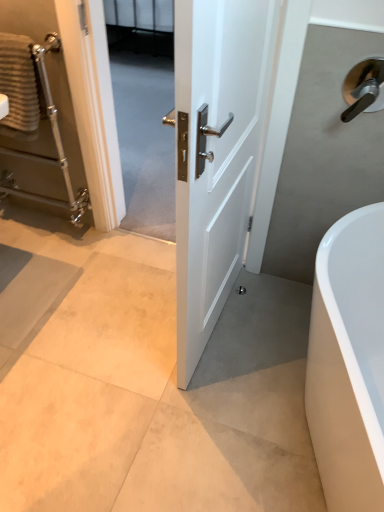
Question: Based on their sizes in the image, would you say polished silver door handle at upper right is bigger or smaller than polished chrome towel rack at left?

Choices:
 (A) small
 (B) big

Answer: (A)

Question: Visually, is polished silver door handle at upper right positioned to the left or to the right of polished chrome towel rack at left?

Choices:
 (A) right
 (B) left

Answer: (A)

Question: Based on their relative distances, which object is farther from the white glossy bathtub at lower right?

Choices:
 (A) white glossy door at center
 (B) polished chrome towel rack at left
 (C) polished silver door handle at upper right
 (D) textured beige towel at left

Answer: (B)

Question: Which of these objects is positioned closest to the polished silver door handle at upper right?

Choices:
 (A) polished chrome towel rack at left
 (B) white glossy bathtub at lower right
 (C) white glossy door at center
 (D) textured beige towel at left

Answer: (C)